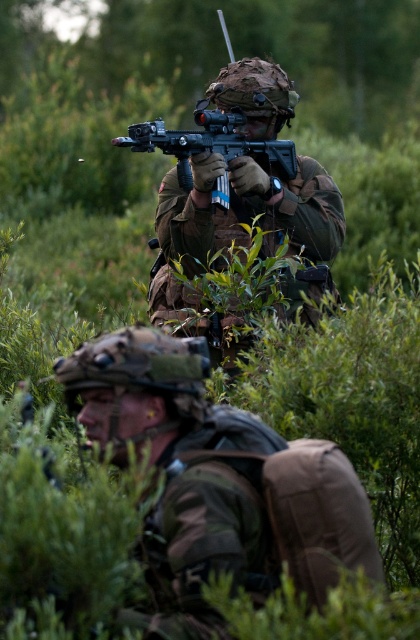
You are a military medic trying to reach a soldier in a dense forest. You see the camouflage fabric uniform at center and the matte black rifle at center. Which object is closer to you?

The camouflage fabric uniform at center is closer to you since it is 10.60 inches away from the matte black rifle at center, meaning the uniform is nearer than the rifle.

You are a military analyst assessing the positioning of the soldiers in the image. The camouflage fabric uniform at center and the matte black rifle at center are both visible. Based on their positions, which object is closer to the observer?

The camouflage fabric uniform at center is closer to the observer because the matte black rifle at center is positioned behind it.

You are a military analyst assessing the image of two soldiers in a forest. You need to determine which object takes up more space in the image. Which is larger in size between the camouflage fabric uniform at center and the matte black rifle at center?

The camouflage fabric uniform at center is bigger than the matte black rifle at center, so the camouflage fabric uniform at center takes up more space in the image.